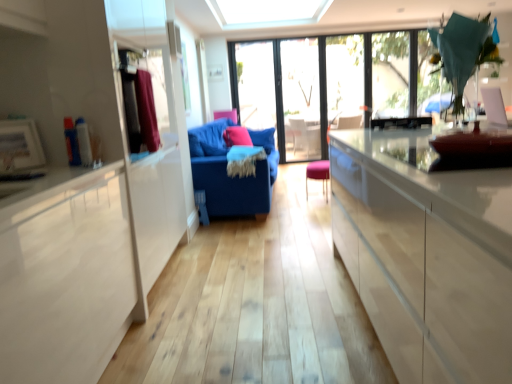
Question: Does matte pink pillow at center have a greater width compared to transparent glass window at center, the first window viewed from the left?

Choices:
 (A) yes
 (B) no

Answer: (A)

Question: Is matte pink pillow at center positioned in front of transparent glass window at center, the first window viewed from the left?

Choices:
 (A) no
 (B) yes

Answer: (B)

Question: Is matte pink pillow at center further to the viewer compared to transparent glass window at center, the first window viewed from the left?

Choices:
 (A) yes
 (B) no

Answer: (B)

Question: Is matte pink pillow at center shorter than transparent glass window at center, the first window viewed from the left?

Choices:
 (A) no
 (B) yes

Answer: (B)

Question: Is matte pink pillow at center oriented away from transparent glass window at center, the first window viewed from the left?

Choices:
 (A) no
 (B) yes

Answer: (A)

Question: From their relative heights in the image, would you say matte pink pillow at center is taller or shorter than velvet maroon curtain at left?

Choices:
 (A) short
 (B) tall

Answer: (A)

Question: Visually, is matte pink pillow at center positioned to the left or to the right of velvet maroon curtain at left?

Choices:
 (A) left
 (B) right

Answer: (B)

Question: From the image's perspective, is matte pink pillow at center located above or below velvet maroon curtain at left?

Choices:
 (A) above
 (B) below

Answer: (A)

Question: From a real-world perspective, is matte pink pillow at center positioned above or below velvet maroon curtain at left?

Choices:
 (A) below
 (B) above

Answer: (A)

Question: Is velvet maroon curtain at left to the left or to the right of blue fabric couch at center in the image?

Choices:
 (A) right
 (B) left

Answer: (B)

Question: Based on their sizes in the image, would you say velvet maroon curtain at left is bigger or smaller than blue fabric couch at center?

Choices:
 (A) small
 (B) big

Answer: (A)

Question: Relative to blue fabric couch at center, is velvet maroon curtain at left in front or behind?

Choices:
 (A) front
 (B) behind

Answer: (A)

Question: From a real-world perspective, is velvet maroon curtain at left above or below blue fabric couch at center?

Choices:
 (A) below
 (B) above

Answer: (B)

Question: In the image, is pink fabric stool at center positioned in front of or behind velvet maroon curtain at left?

Choices:
 (A) front
 (B) behind

Answer: (B)

Question: From the image's perspective, relative to velvet maroon curtain at left, is pink fabric stool at center above or below?

Choices:
 (A) above
 (B) below

Answer: (B)